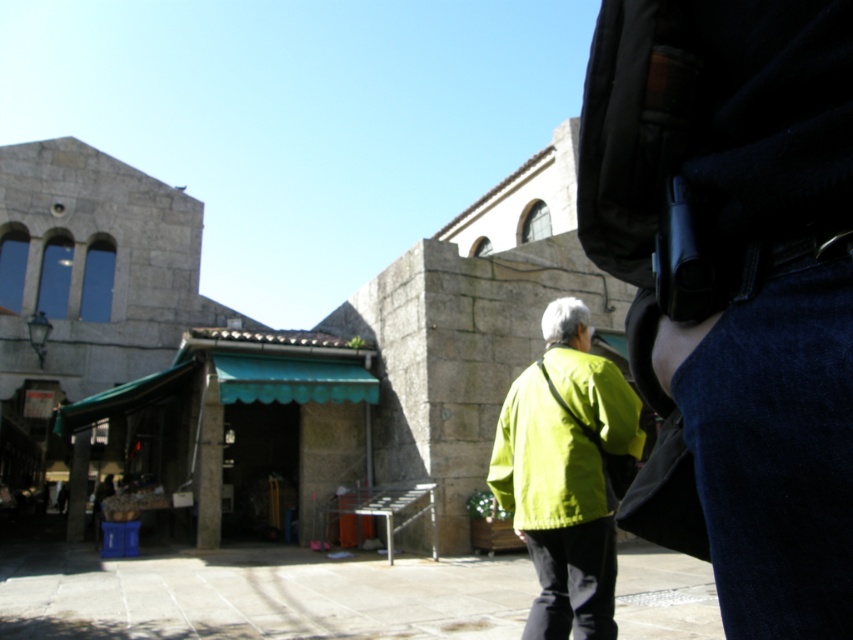
Question: Which point appears farthest from the camera in this image?

Choices:
 (A) (537, 387)
 (B) (750, 250)
 (C) (672, 280)

Answer: (A)

Question: In this image, where is dark blue fabric at center located relative to black leather belt at lower right?

Choices:
 (A) left
 (B) right

Answer: (A)

Question: Estimate the real-world distances between objects in this image. Which object is farther from the smooth concrete alley at center?

Choices:
 (A) black leather belt at right
 (B) dark blue fabric at center
 (C) matte green jacket at center

Answer: (B)

Question: Is black matte jacket at lower right bigger than stone church at left?

Choices:
 (A) no
 (B) yes

Answer: (A)

Question: Is matte green jacket at center behind black leather belt at lower right?

Choices:
 (A) yes
 (B) no

Answer: (A)

Question: Which of the following is the closest to the observer?

Choices:
 (A) smooth concrete alley at center
 (B) stone church at left
 (C) matte green jacket at center

Answer: (C)